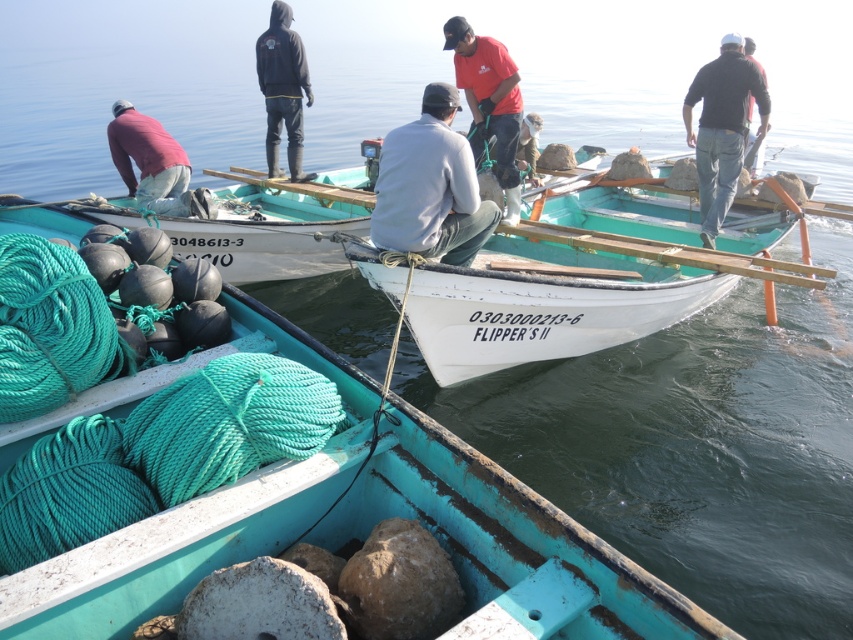
You are trying to decide which clothing item to wear for a fishing trip. You have a gray matte shirt at center and a dark gray sweater at upper center. Which one is narrower?

The gray matte shirt at center has a lesser width compared to the dark gray sweater at upper center, so the gray matte shirt at center is narrower.

From the picture: You are standing on the dock and see the teal painted wood boat at center and the matte pink shirt at lower left. Which object is taller?

The teal painted wood boat at center is taller than the matte pink shirt at lower left.

You are a photographer trying to capture a closeup of the dark gray sweater at upper center and the black rubber boots at upper center. Since your camera can only focus on one object at a time, which object should you choose to ensure the larger one is in focus?

The dark gray sweater at upper center is larger in size than the black rubber boots at upper center, so you should focus on the dark gray sweater at upper center to ensure the larger object is in focus.